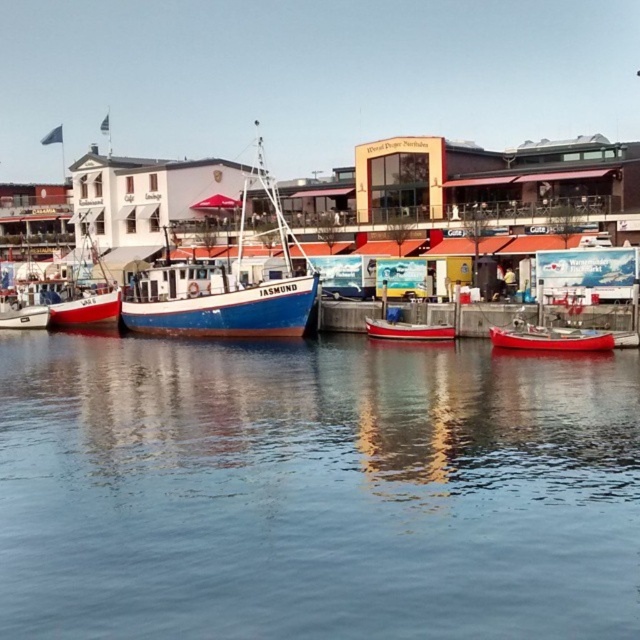
You are a photographer trying to capture the reflection of the JASMUND boat in the transparent water at center. Based on the scene description, where should you position your camera to ensure the reflection is fully visible?

The transparent water at center is located at point (314, 490). Position your camera directly above this point to capture the full reflection of the JASMUND boat.

You are standing on the pier and see the transparent water at center and the red matte canoe at lower right. Which object is closer to your left side?

The transparent water at center is positioned on the left side of red matte canoe at lower right, so it is closer to your left side.